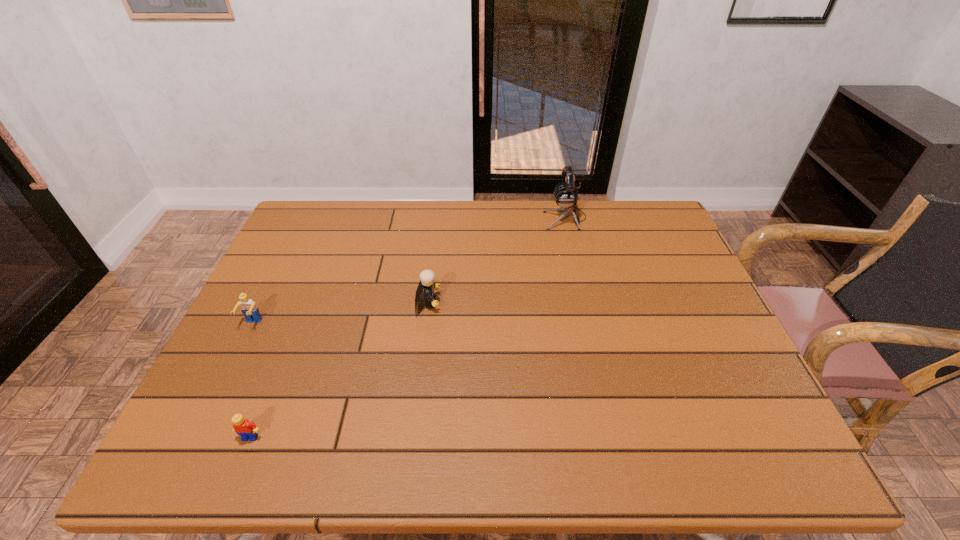
This screenshot has width=960, height=540. Identify the location of the closest object relative to the farthest object. (427, 277).

Identify which Lego is located as the second nearest to the second Lego from left to right. Please provide its 2D coordinates. Your answer should be formatted as a tuple, i.e. [(x, y)], where the tuple contains the x and y coordinates of a point satisfying the conditions above.

[(427, 277)]

Locate which Lego is the second closest to the rightmost Lego. Please provide its 2D coordinates. Your answer should be formatted as a tuple, i.e. [(x, y)], where the tuple contains the x and y coordinates of a point satisfying the conditions above.

[(246, 429)]

Locate an element on the screen. The width and height of the screenshot is (960, 540). free space in the image that satisfies the following two spatial constraints: 1. on the front-facing side of the third object from left to right; 2. on the face of the leftmost object is located at coordinates (425, 324).

This screenshot has width=960, height=540. What are the coordinates of `free point that satisfies the following two spatial constraints: 1. on the front-facing side of the tallest Lego; 2. on the face of the third object from right to left` in the screenshot? It's located at (412, 437).

Locate an element on the screen. Image resolution: width=960 pixels, height=540 pixels. free location that satisfies the following two spatial constraints: 1. on the front-facing side of the tallest Lego; 2. on the face of the nearest Lego is located at coordinates (412, 437).

Find the location of `vacant space that satisfies the following two spatial constraints: 1. on the front-facing side of the rightmost Lego; 2. on the face of the second object from left to right`. vacant space that satisfies the following two spatial constraints: 1. on the front-facing side of the rightmost Lego; 2. on the face of the second object from left to right is located at coordinates (412, 437).